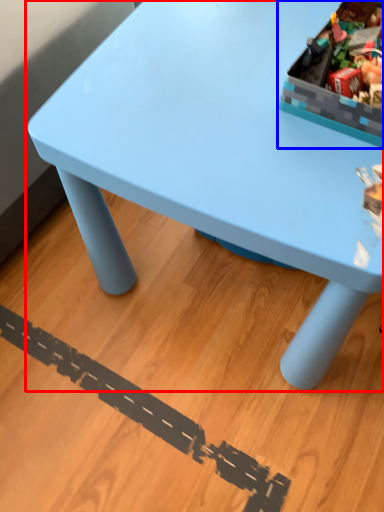
Question: Which object is closer to the camera taking this photo, table (highlighted by a red box) or storage box (highlighted by a blue box)?

Choices:
 (A) table
 (B) storage box

Answer: (A)